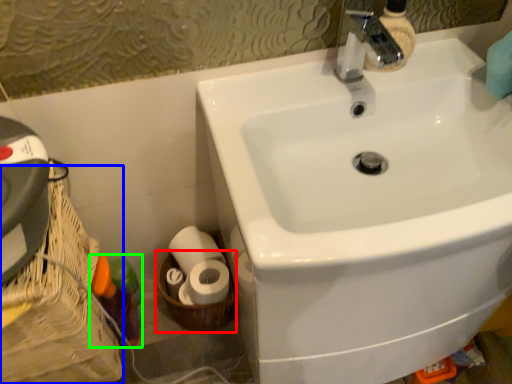
Question: Which object is positioned closest to basket container (highlighted by a red box)? Select from basket container (highlighted by a blue box) and bottle (highlighted by a green box).

Choices:
 (A) basket container
 (B) bottle

Answer: (B)